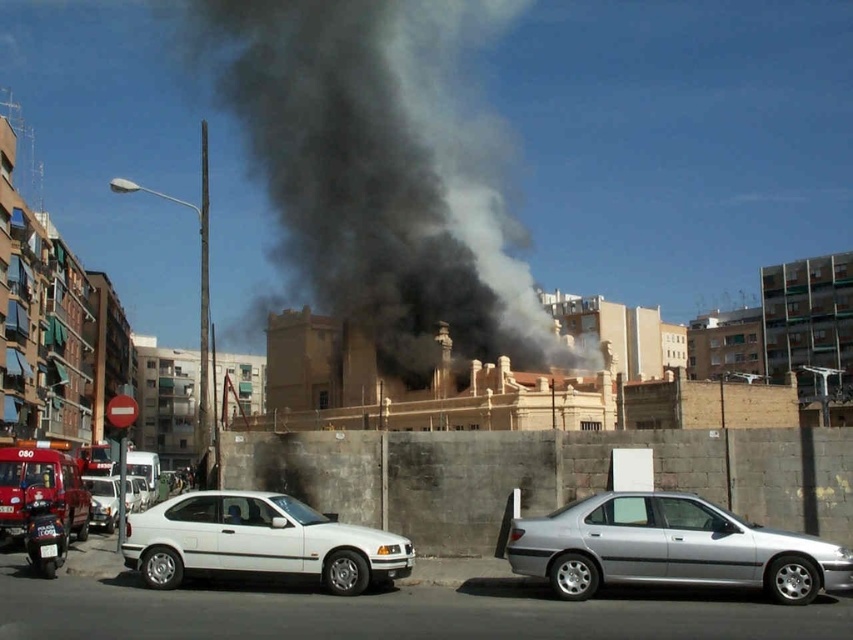
You are a fire inspector standing at the center of the scene. You need to quickly locate the shiny red fire truck at lower left. Based on its 2D coordinates, in which direction should you move to reach it?

The shiny red fire truck at lower left is located at coordinates point (41,488). Since you are at the center, you should move downward and to the right to reach it.

You are a delivery driver who needs to pass through the area shown in the image. You see the black smoke at center and the white matte van at left. Which object is closer to you as you approach the scene?

The black smoke at center is closer to you than the white matte van at left because it is further to the viewer according to the description.

Based on the photo, you are a pedestrian standing at the scene. You see the shiny red fire truck at lower left and the white matte van at left. Which vehicle is closer to you?

The shiny red fire truck at lower left is closer to you because it is positioned under the white matte van at left, meaning it is in front of the van.